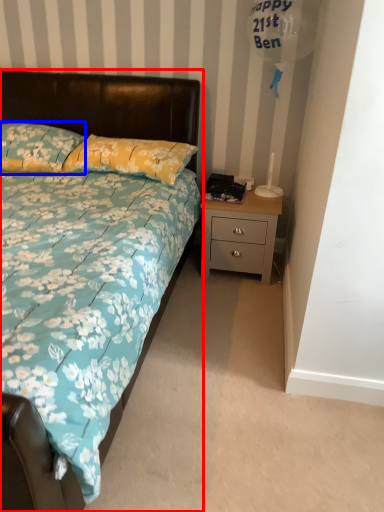
Question: Which object is further to the camera taking this photo, bed (highlighted by a red box) or pillow (highlighted by a blue box)?

Choices:
 (A) bed
 (B) pillow

Answer: (B)